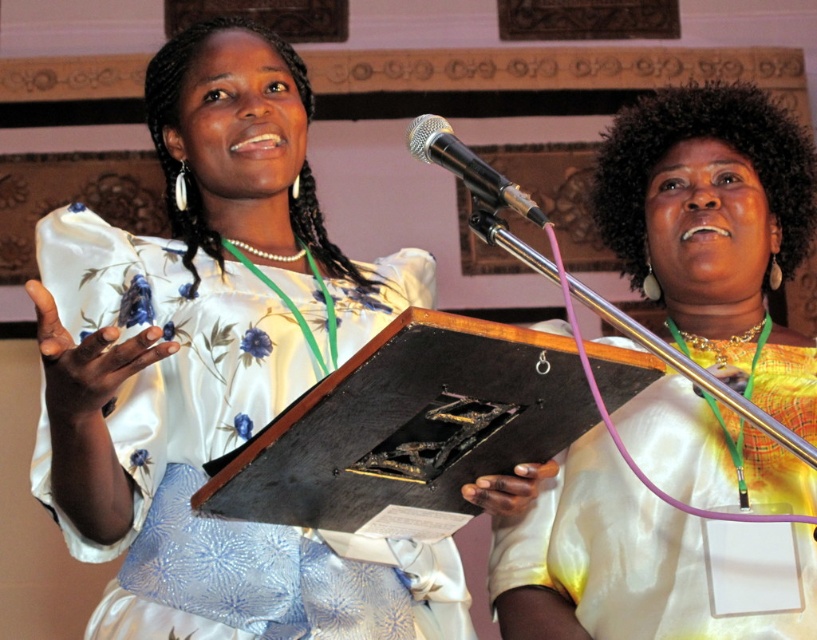
Can you confirm if satin floral dress at center is thinner than black wood plaque at center?

No.

Can you confirm if satin floral dress at center is positioned below black wood plaque at center?

No.

Who is more forward, (148, 280) or (311, 483)?

Point (311, 483) is more forward.

You are a GUI agent. You are given a task and a screenshot of the screen. Output one action in this format:
    pyautogui.click(x=<x>, y=<y>)
    Task: Click on the satin floral dress at center
    
    Given the screenshot: What is the action you would take?
    pyautogui.click(x=213, y=458)

Can you confirm if black wood plaque at center is positioned to the right of metallic/metallic microphone at upper center?

In fact, black wood plaque at center is to the left of metallic/metallic microphone at upper center.

Who is more distant from viewer, (478, 349) or (505, 189)?

The point (505, 189) is behind.

At what (x,y) coordinates should I click in order to perform the action: click on black wood plaque at center. Please return your answer as a coordinate pair (x, y). This screenshot has height=640, width=817. Looking at the image, I should click on (407, 429).

Who is positioned more to the right, matte gold blouse at center or black wood plaque at center?

matte gold blouse at center

Which is behind, point (630, 177) or point (552, 336)?

The point (630, 177) is more distant.

Find the location of a particular element. matte gold blouse at center is located at coordinates (717, 228).